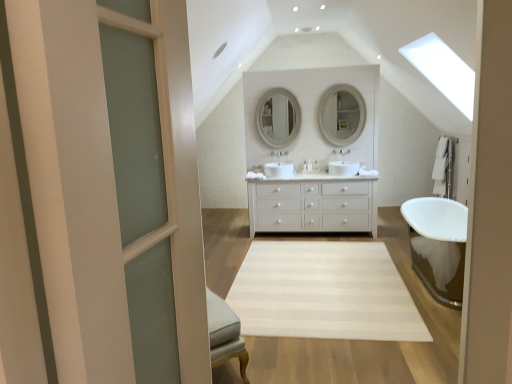
Locate an element on the screen. This screenshot has height=384, width=512. free space above white striped rug at center (from a real-world perspective) is located at coordinates (321, 279).